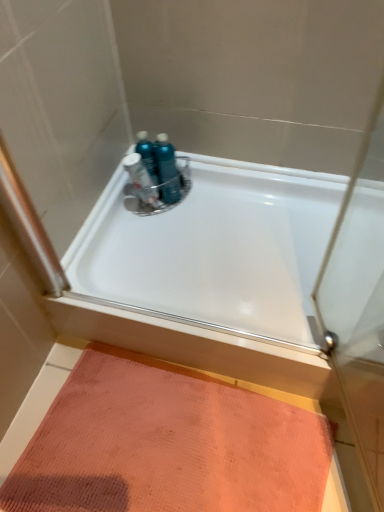
Question: Is orange textured mat at lower left far from translucent plastic bottles at center, which is the first toiletry from left to right?

Choices:
 (A) no
 (B) yes

Answer: (A)

Question: Is orange textured mat at lower left closer to camera compared to translucent plastic bottles at center, which is the first toiletry from left to right?

Choices:
 (A) yes
 (B) no

Answer: (A)

Question: Is orange textured mat at lower left surrounding translucent plastic bottles at center, positioned as the third toiletry in right-to-left order?

Choices:
 (A) yes
 (B) no

Answer: (B)

Question: Is orange textured mat at lower left not inside translucent plastic bottles at center, positioned as the third toiletry in right-to-left order?

Choices:
 (A) yes
 (B) no

Answer: (A)

Question: Does orange textured mat at lower left have a greater height compared to translucent plastic bottles at center, positioned as the third toiletry in right-to-left order?

Choices:
 (A) no
 (B) yes

Answer: (A)

Question: From a real-world perspective, is orange textured mat at lower left physically located above or below teal plastic bottles at center, positioned as the first toiletry in right-to-left order?

Choices:
 (A) above
 (B) below

Answer: (B)

Question: From the image's perspective, is orange textured mat at lower left above or below teal plastic bottles at center, the third toiletry viewed from the left?

Choices:
 (A) below
 (B) above

Answer: (A)

Question: Is orange textured mat at lower left taller or shorter than teal plastic bottles at center, the third toiletry viewed from the left?

Choices:
 (A) tall
 (B) short

Answer: (B)

Question: Choose the correct answer: Is orange textured mat at lower left inside teal plastic bottles at center, positioned as the first toiletry in right-to-left order, or outside it?

Choices:
 (A) inside
 (B) outside

Answer: (B)

Question: From a real-world perspective, is blue glossy bottles at upper center, which is counted as the second toiletry, starting from the left, physically located above or below translucent plastic bottles at center, which is the first toiletry from left to right?

Choices:
 (A) above
 (B) below

Answer: (A)

Question: From the image's perspective, is blue glossy bottles at upper center, the second toiletry positioned from the right, positioned above or below translucent plastic bottles at center, which is the first toiletry from left to right?

Choices:
 (A) below
 (B) above

Answer: (B)

Question: In the image, is blue glossy bottles at upper center, the second toiletry positioned from the right, positioned in front of or behind translucent plastic bottles at center, which is the first toiletry from left to right?

Choices:
 (A) behind
 (B) front

Answer: (A)

Question: Looking at their shapes, would you say blue glossy bottles at upper center, which is counted as the second toiletry, starting from the left, is wider or thinner than translucent plastic bottles at center, positioned as the third toiletry in right-to-left order?

Choices:
 (A) wide
 (B) thin

Answer: (A)

Question: From a real-world perspective, is teal plastic bottles at center, positioned as the first toiletry in right-to-left order, above or below white glossy bathtub at center?

Choices:
 (A) above
 (B) below

Answer: (A)

Question: Do you think teal plastic bottles at center, the third toiletry viewed from the left, is within white glossy bathtub at center, or outside of it?

Choices:
 (A) inside
 (B) outside

Answer: (B)